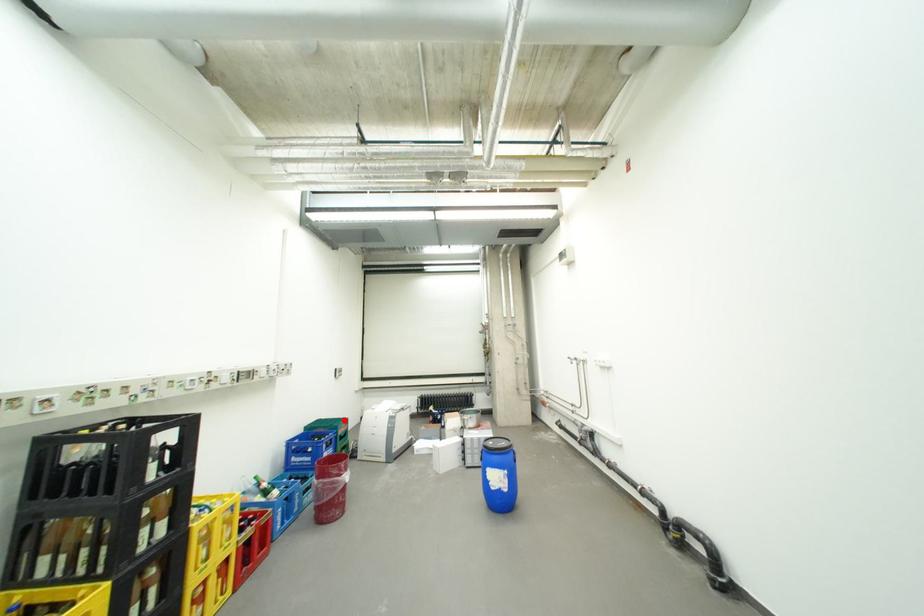
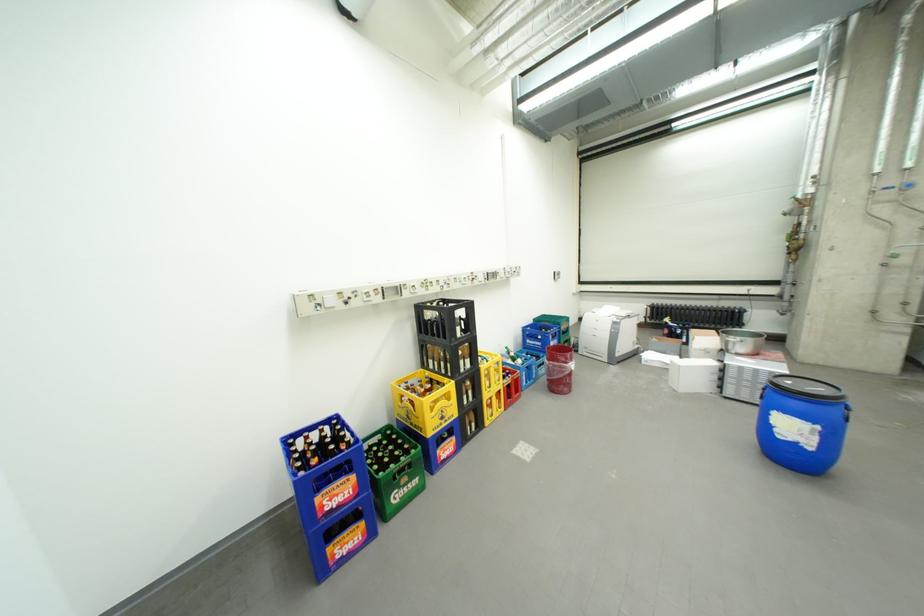
The point at the highlighted location is marked in the first image. Where is the corresponding point in the second image?

(565, 317)